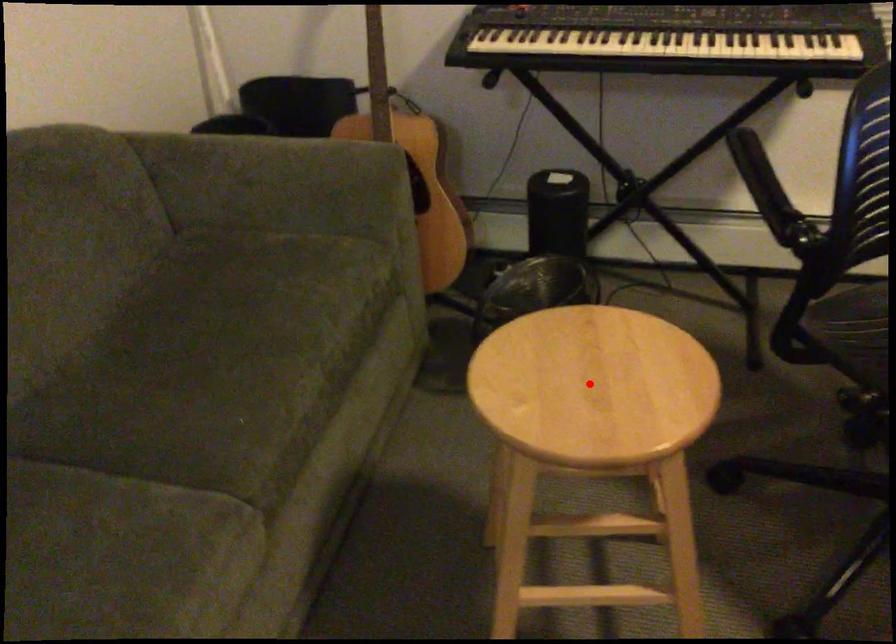
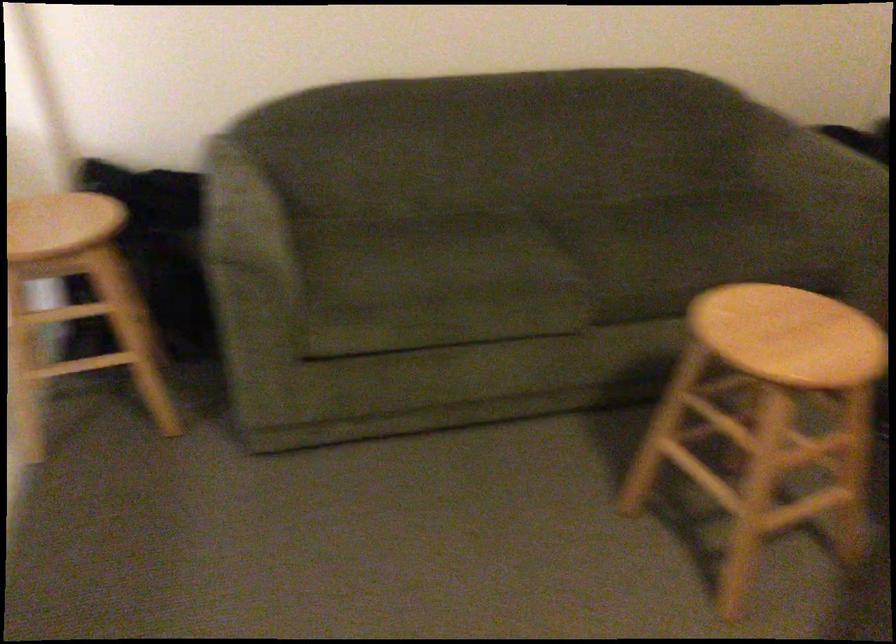
Question: I am providing you with two images of the same scene from different viewpoints. In image1, a red point is highlighted. Considering the same 3D point in image2, which of the following is correct?

Choices:
 (A) It is closer
 (B) It is farther

Answer: (B)